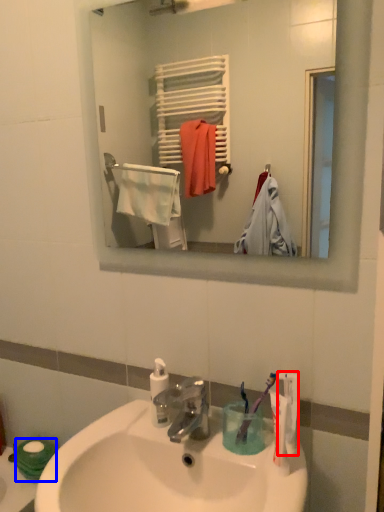
Question: Among these objects, which one is farthest to the camera, toothpaste (highlighted by a red box) or toilet paper (highlighted by a blue box)?

Choices:
 (A) toothpaste
 (B) toilet paper

Answer: (B)